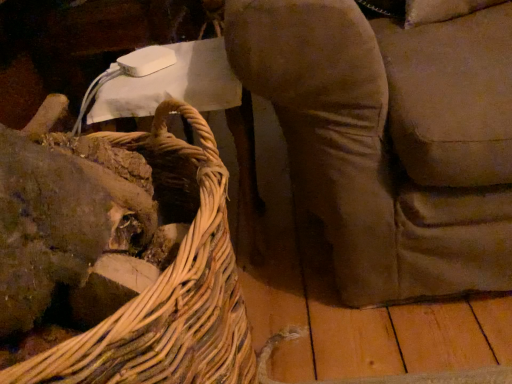
I want to click on woven wood picnic basket at left, so click(x=167, y=295).

What do you see at coordinates (167, 295) in the screenshot? The image size is (512, 384). I see `woven wood picnic basket at left` at bounding box center [167, 295].

In order to face velvet brown armchair at center, should I rotate leftwards or rightwards?

Turn right by 22.890 degrees to look at velvet brown armchair at center.

Find the location of a particular element. The width and height of the screenshot is (512, 384). velvet brown armchair at center is located at coordinates (391, 139).

The image size is (512, 384). What do you see at coordinates (391, 139) in the screenshot? I see `velvet brown armchair at center` at bounding box center [391, 139].

The height and width of the screenshot is (384, 512). I want to click on woven wood picnic basket at left, so click(x=167, y=295).

Can you confirm if woven wood picnic basket at left is positioned to the left of velvet brown armchair at center?

Yes.

From the picture: Is woven wood picnic basket at left positioned behind velvet brown armchair at center?

No, woven wood picnic basket at left is in front of velvet brown armchair at center.

Which is in front, point (194, 111) or point (490, 82)?

The point (194, 111) is closer.

Based on the photo, from the image's perspective, is woven wood picnic basket at left positioned above or below velvet brown armchair at center?

Based on their image positions, woven wood picnic basket at left is located beneath velvet brown armchair at center.

From a real-world perspective, which is physically above, woven wood picnic basket at left or velvet brown armchair at center?

From a 3D spatial view, velvet brown armchair at center is above.

Which of these two, woven wood picnic basket at left or velvet brown armchair at center, is thinner?

With smaller width is woven wood picnic basket at left.

Is woven wood picnic basket at left shorter than velvet brown armchair at center?

In fact, woven wood picnic basket at left may be taller than velvet brown armchair at center.

Who is smaller, woven wood picnic basket at left or velvet brown armchair at center?

Smaller between the two is woven wood picnic basket at left.

Is velvet brown armchair at center a part of woven wood picnic basket at left?

That's incorrect, velvet brown armchair at center is not inside woven wood picnic basket at left.

Would you say woven wood picnic basket at left is a long distance from velvet brown armchair at center?

No.

Could you tell me if woven wood picnic basket at left is facing velvet brown armchair at center?

No, woven wood picnic basket at left is not aimed at velvet brown armchair at center.

Looking at this image, how many degrees apart are the facing directions of woven wood picnic basket at left and velvet brown armchair at center?

The facing directions of woven wood picnic basket at left and velvet brown armchair at center are 88.9 degrees apart.

Locate an element on the screen. This screenshot has width=512, height=384. picnic basket in front of the velvet brown armchair at center is located at coordinates (167, 295).

In the image, is velvet brown armchair at center on the left side or the right side of woven wood picnic basket at left?

Clearly, velvet brown armchair at center is on the right of woven wood picnic basket at left in the image.

Is the depth of velvet brown armchair at center greater than that of woven wood picnic basket at left?

Yes, velvet brown armchair at center is further from the viewer.

Which is less distant, (x=357, y=304) or (x=149, y=374)?

The point (x=149, y=374) is closer to the camera.

From the image's perspective, is velvet brown armchair at center above woven wood picnic basket at left?

Correct, velvet brown armchair at center appears higher than woven wood picnic basket at left in the image.

From a real-world perspective, is velvet brown armchair at center on woven wood picnic basket at left?

Indeed, from a real-world perspective, velvet brown armchair at center stands above woven wood picnic basket at left.

Can you confirm if velvet brown armchair at center is wider than woven wood picnic basket at left?

Correct, the width of velvet brown armchair at center exceeds that of woven wood picnic basket at left.

Which of these two, velvet brown armchair at center or woven wood picnic basket at left, stands taller?

woven wood picnic basket at left.

Who is smaller, velvet brown armchair at center or woven wood picnic basket at left?

With smaller size is woven wood picnic basket at left.

Is woven wood picnic basket at left surrounded by velvet brown armchair at center?

No, woven wood picnic basket at left is not inside velvet brown armchair at center.

From the picture: Is velvet brown armchair at center placed right next to woven wood picnic basket at left?

velvet brown armchair at center and woven wood picnic basket at left are not in contact.

Is woven wood picnic basket at left at the back of velvet brown armchair at center?

velvet brown armchair at center is not turned away from woven wood picnic basket at left.

What's the angular difference between velvet brown armchair at center and woven wood picnic basket at left's facing directions?

There is a 88.9-degree angle between the facing directions of velvet brown armchair at center and woven wood picnic basket at left.

The height and width of the screenshot is (384, 512). I want to click on furniture above the woven wood picnic basket at left (from a real-world perspective), so click(x=391, y=139).

Locate an element on the screen. The image size is (512, 384). picnic basket in front of the velvet brown armchair at center is located at coordinates (x=167, y=295).

In the image, there is a woven wood picnic basket at left. Where is `furniture above it (from the image's perspective)`? The width and height of the screenshot is (512, 384). furniture above it (from the image's perspective) is located at coordinates (391, 139).